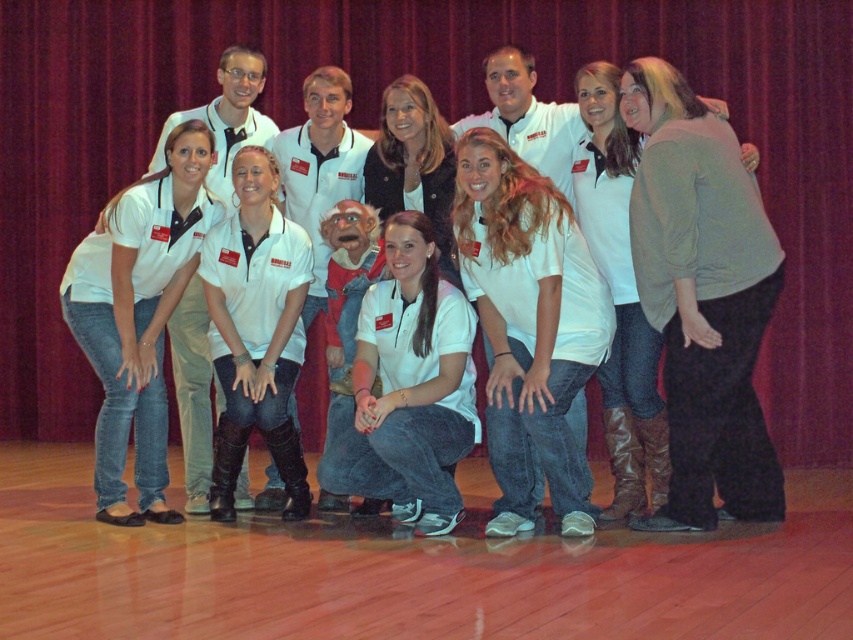
You are a photographer adjusting the lighting for a group photo. You notice the green textured sweater at right and the white cotton shirt at center. Which clothing item is covering part of the other?

The green textured sweater at right is positioned over the white cotton shirt at center, so it is covering part of it.

In the scene shown: You are a photographer adjusting the camera settings to capture the group photo. You notice the green textured sweater at right and the white cotton shirt at center. Which clothing item requires more space in the frame to avoid being cut off?

The green textured sweater at right requires more space in the frame because its width surpasses that of the white cotton shirt at center.